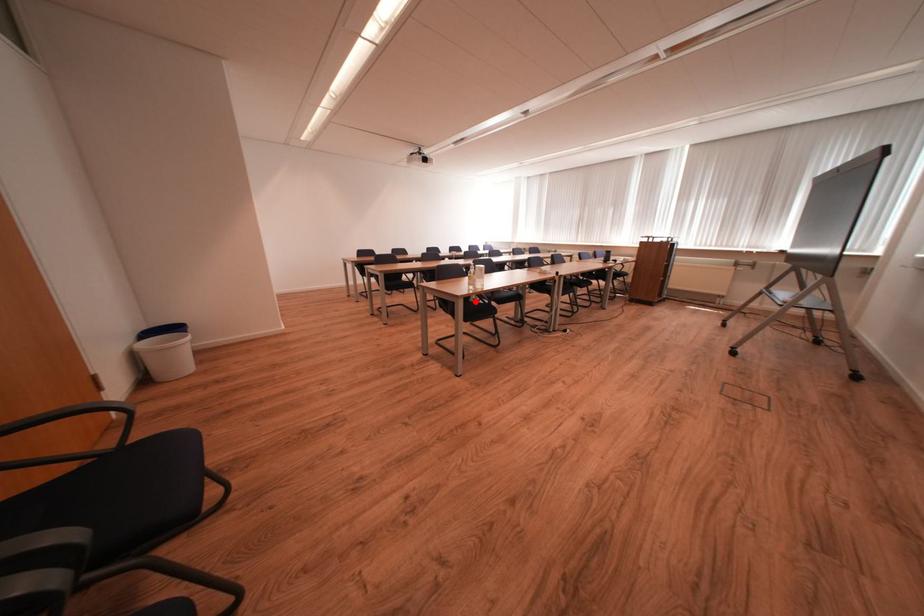
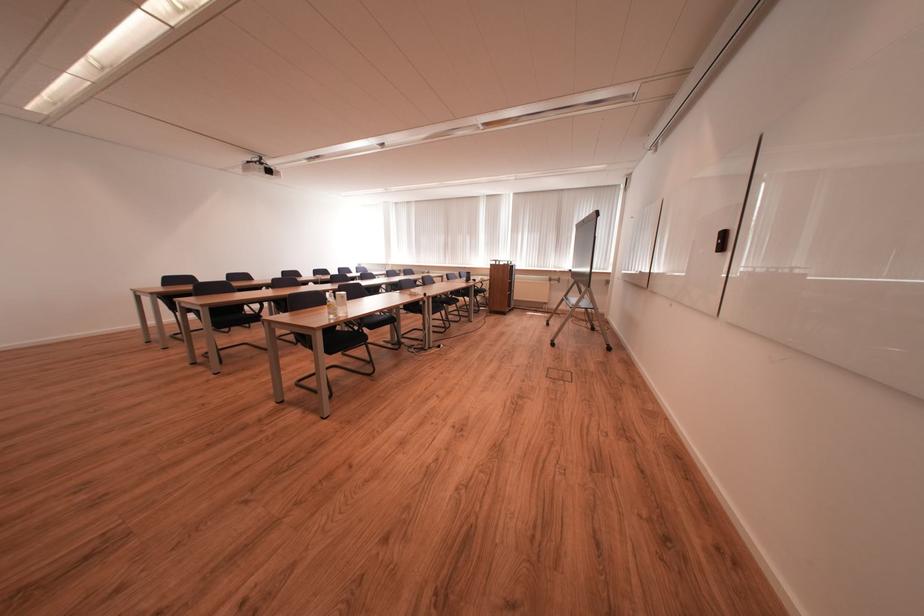
Where in the second image is the point corresponding to the highlighted location from the first image?

(337, 331)